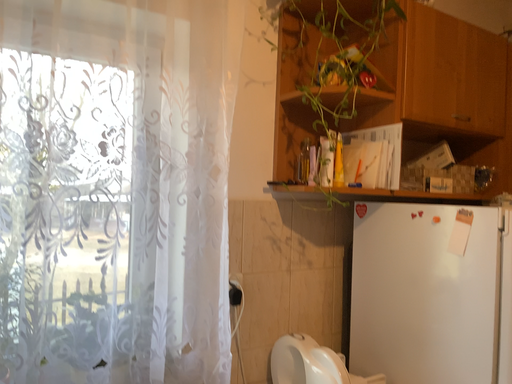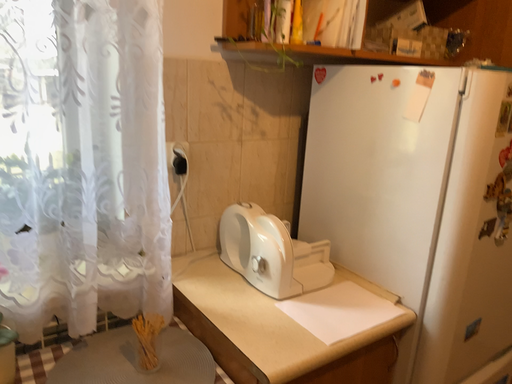
Question: Which way did the camera rotate in the video?

Choices:
 (A) rotated downward
 (B) rotated upward

Answer: (A)